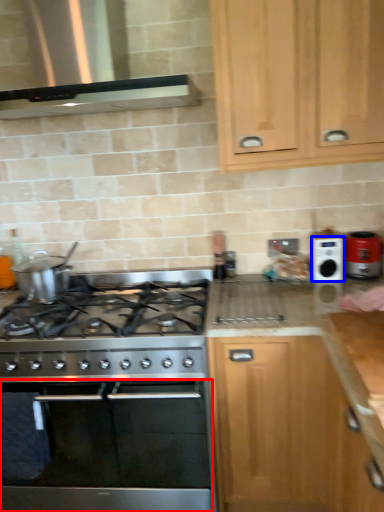
Question: Among these objects, which one is farthest to the camera, oven (highlighted by a red box) or appliance (highlighted by a blue box)?

Choices:
 (A) oven
 (B) appliance

Answer: (B)